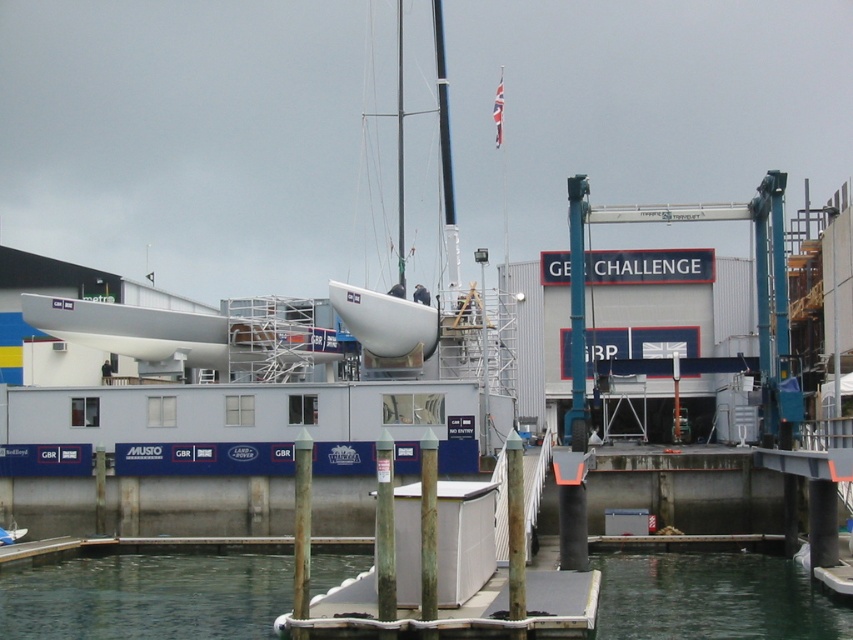
Who is more forward, (231,612) or (280,333)?

Point (231,612) is more forward.

Is clear water at dock center further to the viewer compared to white matte boat at center?

No, clear water at dock center is in front of white matte boat at center.

The width and height of the screenshot is (853, 640). In order to click on clear water at dock center in this screenshot , I will do (x=146, y=595).